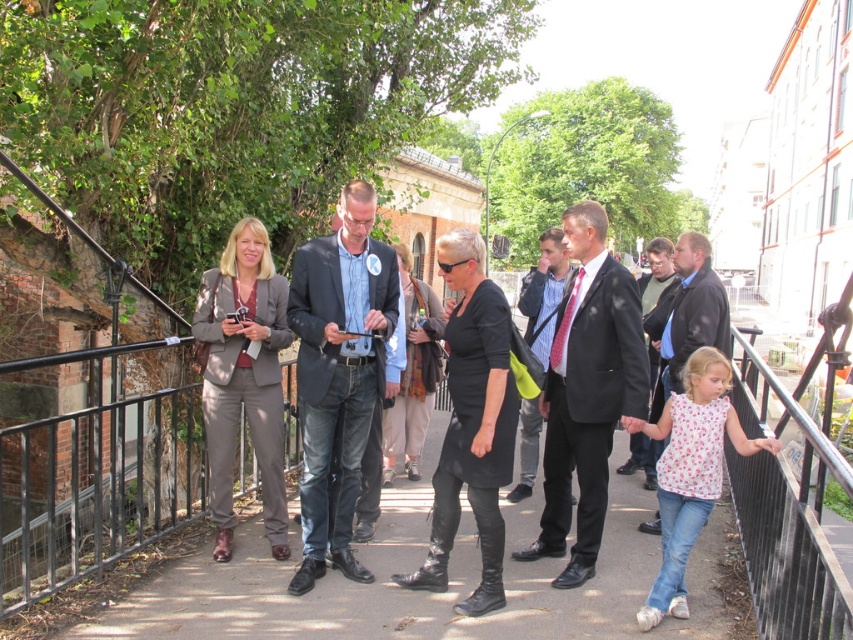
Is point (659, 564) farther from viewer compared to point (454, 260)?

Yes, point (659, 564) is farther from viewer.

Between point (515, 570) and point (489, 435), which one is positioned in front?

Point (489, 435)

The height and width of the screenshot is (640, 853). What do you see at coordinates (425, 593) in the screenshot?
I see `black leather boots at center` at bounding box center [425, 593].

Locate an element on the screen. This screenshot has width=853, height=640. black leather boots at center is located at coordinates (425, 593).

Which of these two, black leather jacket at center or black leather dress at center, stands taller?

black leather jacket at center

Between black leather jacket at center and black leather dress at center, which one has less height?

black leather dress at center is shorter.

Is point (299, 412) less distant than point (459, 275)?

No, it is not.

Where is `black leather jacket at center`? The height and width of the screenshot is (640, 853). black leather jacket at center is located at coordinates (331, 371).

Looking at this image, does black leather jacket at center have a greater height compared to dark gray suit at center?

Incorrect, black leather jacket at center's height is not larger of dark gray suit at center's.

Who is taller, black leather jacket at center or dark gray suit at center?

Standing taller between the two is dark gray suit at center.

Find the location of a particular element. black leather jacket at center is located at coordinates (331, 371).